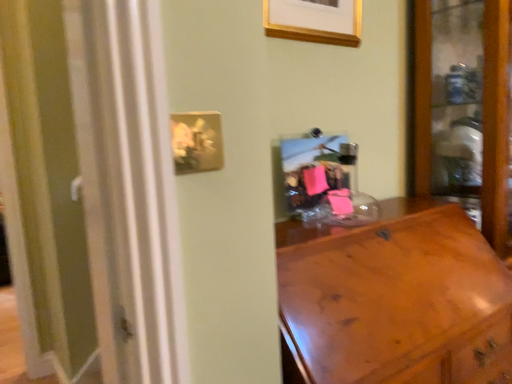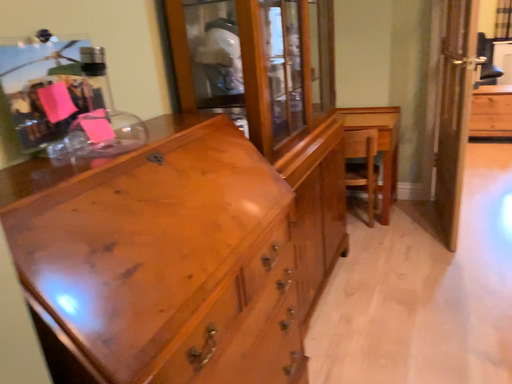
Question: Which way did the camera rotate in the video?

Choices:
 (A) rotated upward
 (B) rotated downward

Answer: (B)